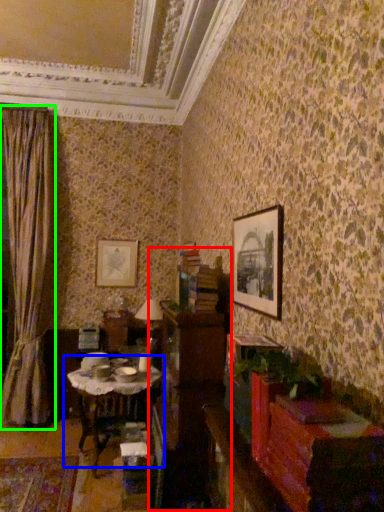
Question: Considering the real-world distances, which object is closest to dresser (highlighted by a red box)? table (highlighted by a blue box) or curtain (highlighted by a green box).

Choices:
 (A) table
 (B) curtain

Answer: (A)